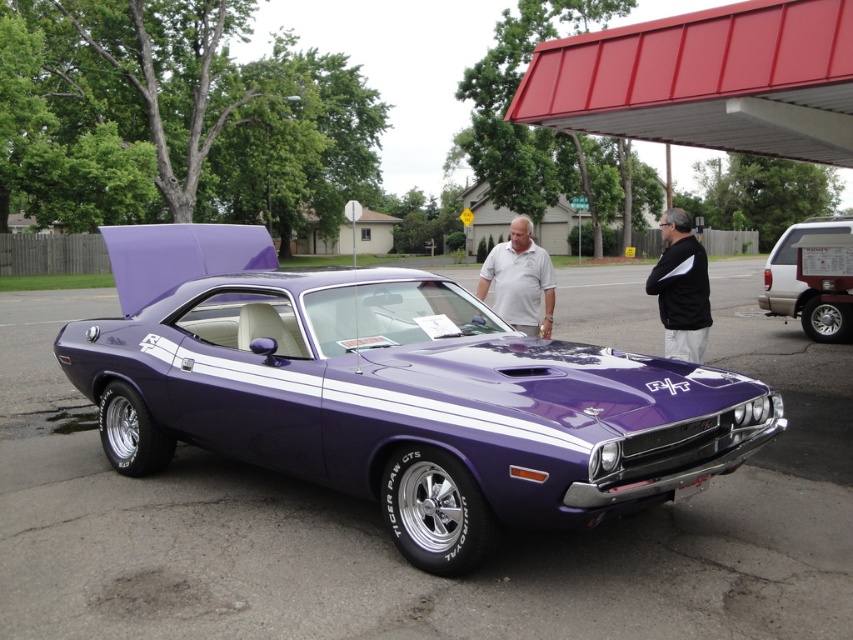
Question: Can you confirm if black fabric shirt at center is positioned above white smooth shirt at center?

Choices:
 (A) yes
 (B) no

Answer: (B)

Question: Among these points, which one is nearest to the camera?

Choices:
 (A) (450, 548)
 (B) (538, 280)
 (C) (788, 300)

Answer: (A)

Question: Which object is positioned farthest from the white smooth shirt at center?

Choices:
 (A) purple glossy muscle car at center
 (B) maroon matte suv at right

Answer: (B)

Question: Is maroon matte suv at right wider than white smooth shirt at center?

Choices:
 (A) no
 (B) yes

Answer: (A)

Question: Which object appears farthest from the camera in this image?

Choices:
 (A) purple glossy muscle car at center
 (B) maroon matte suv at right
 (C) white smooth shirt at center
 (D) black fabric shirt at center

Answer: (B)

Question: Is black fabric shirt at center bigger than white smooth shirt at center?

Choices:
 (A) yes
 (B) no

Answer: (B)